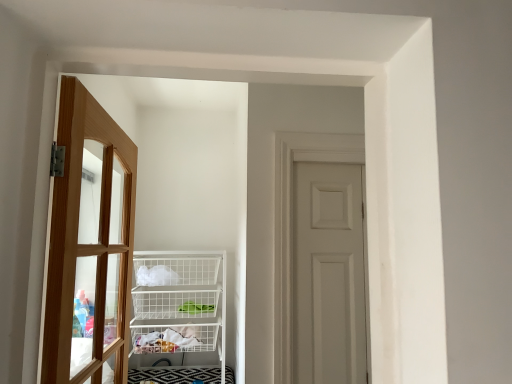
What do you see at coordinates (179, 317) in the screenshot?
I see `white wire basket at center` at bounding box center [179, 317].

Describe the element at coordinates (329, 274) in the screenshot. The width and height of the screenshot is (512, 384). I see `white matte door at center, placed as the 1th door when sorted from right to left` at that location.

In order to click on light brown wooden door at left, the 1th door from the front in this screenshot , I will do coord(89,244).

This screenshot has height=384, width=512. What are the coordinates of `white wire basket at center` in the screenshot? It's located at point(179,317).

Can you see light brown wooden door at left, which appears as the 2th door when viewed from the back, touching white wire basket at center?

No, light brown wooden door at left, which appears as the 2th door when viewed from the back, is not with white wire basket at center.

From a real-world perspective, which object stands above the other?

In real-world perspective, light brown wooden door at left, which is the 2th door from right to left, is above.

Which of these two, light brown wooden door at left, the 1th door from the front, or white wire basket at center, is bigger?

white wire basket at center is bigger.

Which object is wider, light brown wooden door at left, which appears as the 2th door when viewed from the back, or white matte door at center, the 1th door when ordered from back to front?

Wider between the two is light brown wooden door at left, which appears as the 2th door when viewed from the back.

Are light brown wooden door at left, which appears as the 2th door when viewed from the back, and white matte door at center, the second door positioned from the left, beside each other?

There is a gap between light brown wooden door at left, which appears as the 2th door when viewed from the back, and white matte door at center, the second door positioned from the left.

Would you say light brown wooden door at left, the 1th door from the front, is outside white matte door at center, the 1th door when ordered from back to front?

Absolutely, light brown wooden door at left, the 1th door from the front, is external to white matte door at center, the 1th door when ordered from back to front.

Is point (109, 293) positioned before point (334, 277)?

No, (109, 293) is behind (334, 277).

Does white matte door at center, positioned as the second door in front-to-back order, have a larger size compared to light brown wooden door at left, which is the 2th door from right to left?

No.

Looking at this image, is white matte door at center, placed as the 1th door when sorted from right to left, to the left or to the right of light brown wooden door at left, which appears as the 2th door when viewed from the back, in the image?

From the image, it's evident that white matte door at center, placed as the 1th door when sorted from right to left, is to the right of light brown wooden door at left, which appears as the 2th door when viewed from the back.

Is there a large distance between white matte door at center, positioned as the second door in front-to-back order, and light brown wooden door at left, the 1th door from the front?

No, white matte door at center, positioned as the second door in front-to-back order, is in close proximity to light brown wooden door at left, the 1th door from the front.

Is white matte door at center, the second door positioned from the left, facing away from light brown wooden door at left, which appears as the 2th door when viewed from the back?

No, white matte door at center, the second door positioned from the left,'s orientation is not away from light brown wooden door at left, which appears as the 2th door when viewed from the back.

Does white matte door at center, placed as the 1th door when sorted from right to left, have a greater width compared to white wire basket at center?

No.

How many degrees apart are the facing directions of white matte door at center, the 1th door when ordered from back to front, and white wire basket at center?

They differ by 0.125 degrees in their facing directions.

Can you confirm if white matte door at center, placed as the 1th door when sorted from right to left, is smaller than white wire basket at center?

Indeed, white matte door at center, placed as the 1th door when sorted from right to left, has a smaller size compared to white wire basket at center.

Could you tell me if white matte door at center, the second door positioned from the left, is turned towards white wire basket at center?

No, white matte door at center, the second door positioned from the left, is not oriented towards white wire basket at center.

From a real-world perspective, is white wire basket at center on top of light brown wooden door at left, which is the 2th door from right to left?

No, from a real-world perspective, white wire basket at center is not on top of light brown wooden door at left, which is the 2th door from right to left.

Is white wire basket at center far from light brown wooden door at left, the 1th door from the front?

No.

Relative to light brown wooden door at left, placed as the first door when sorted from left to right, is white wire basket at center in front or behind?

In the image, white wire basket at center appears behind light brown wooden door at left, placed as the first door when sorted from left to right.

At what (x,y) coordinates should I click in order to perform the action: click on door that is the 2nd object located above the white wire basket at center (from the image's perspective). Please return your answer as a coordinate pair (x, y). The height and width of the screenshot is (384, 512). Looking at the image, I should click on (89, 244).

Which object is further away from the camera taking this photo, white wire basket at center or white matte door at center, the 1th door when ordered from back to front?

white wire basket at center is more distant.

From a real-world perspective, between white wire basket at center and white matte door at center, the 1th door when ordered from back to front, who is vertically higher?

white matte door at center, the 1th door when ordered from back to front, is physically above.

From the image's perspective, is white wire basket at center located beneath white matte door at center, positioned as the second door in front-to-back order?

Yes, from the image's perspective, white wire basket at center is beneath white matte door at center, positioned as the second door in front-to-back order.

I want to click on shelf on the left of white matte door at center, placed as the 1th door when sorted from right to left, so (x=179, y=317).

Where is `door that is on the left side of white wire basket at center`? Image resolution: width=512 pixels, height=384 pixels. door that is on the left side of white wire basket at center is located at coordinates (89, 244).

This screenshot has height=384, width=512. Identify the location of door that is below the light brown wooden door at left, which is the 2th door from right to left (from the image's perspective). (329, 274).

Estimate the real-world distances between objects in this image. Which object is closer to light brown wooden door at left, which appears as the 2th door when viewed from the back, white matte door at center, the 1th door when ordered from back to front, or white wire basket at center?

white wire basket at center is closer to light brown wooden door at left, which appears as the 2th door when viewed from the back.

Looking at the image, which one is located further to light brown wooden door at left, placed as the first door when sorted from left to right, white wire basket at center or white matte door at center, placed as the 1th door when sorted from right to left?

Among the two, white matte door at center, placed as the 1th door when sorted from right to left, is located further to light brown wooden door at left, placed as the first door when sorted from left to right.

Based on the photo, based on their spatial positions, is light brown wooden door at left, which appears as the 2th door when viewed from the back, or white matte door at center, placed as the 1th door when sorted from right to left, further from white wire basket at center?

Based on the image, white matte door at center, placed as the 1th door when sorted from right to left, appears to be further to white wire basket at center.

Which object lies nearer to the anchor point white matte door at center, placed as the 1th door when sorted from right to left, light brown wooden door at left, the 1th door from the front, or white wire basket at center?

white wire basket at center is positioned closer to the anchor white matte door at center, placed as the 1th door when sorted from right to left.

Estimate the real-world distances between objects in this image. Which object is closer to white matte door at center, positioned as the second door in front-to-back order, white wire basket at center or light brown wooden door at left, which appears as the 2th door when viewed from the back?

white wire basket at center.

Estimate the real-world distances between objects in this image. Which object is closer to white wire basket at center, white matte door at center, positioned as the second door in front-to-back order, or light brown wooden door at left, which is the 2th door from right to left?

light brown wooden door at left, which is the 2th door from right to left, lies closer to white wire basket at center than the other object.

Find the location of a particular element. door between light brown wooden door at left, the 1th door from the front, and white wire basket at center, along the z-axis is located at coordinates (329, 274).